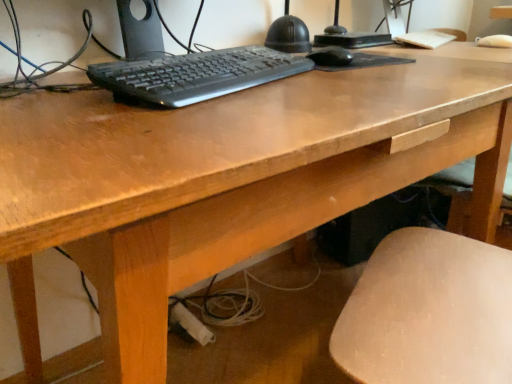
I want to click on black plastic keyboard at center, so click(196, 74).

Looking at this image, measure the distance between black plastic keyboard at center and camera.

black plastic keyboard at center and camera are 21.69 inches apart.

This screenshot has width=512, height=384. What do you see at coordinates (196, 74) in the screenshot?
I see `black plastic keyboard at center` at bounding box center [196, 74].

Identify the location of black matte mouse at center. This screenshot has height=384, width=512. (331, 57).

What do you see at coordinates (331, 57) in the screenshot? This screenshot has width=512, height=384. I see `black matte mouse at center` at bounding box center [331, 57].

The width and height of the screenshot is (512, 384). Identify the location of black plastic keyboard at center. (196, 74).

In the image, is black matte mouse at center on the left side or the right side of black plastic keyboard at center?

From the image, it's evident that black matte mouse at center is to the right of black plastic keyboard at center.

Relative to black plastic keyboard at center, is black matte mouse at center in front or behind?

In the image, black matte mouse at center appears behind black plastic keyboard at center.

Is point (320, 49) farther from viewer compared to point (204, 66)?

Yes, point (320, 49) is farther from viewer.

From the image's perspective, is black matte mouse at center positioned above or below black plastic keyboard at center?

Clearly, from the image's perspective, black matte mouse at center is above black plastic keyboard at center.

From a real-world perspective, who is located lower, black matte mouse at center or black plastic keyboard at center?

black matte mouse at center.

Considering the sizes of objects black matte mouse at center and black plastic keyboard at center in the image provided, who is thinner, black matte mouse at center or black plastic keyboard at center?

black matte mouse at center.

Considering the sizes of objects black matte mouse at center and black plastic keyboard at center in the image provided, who is taller, black matte mouse at center or black plastic keyboard at center?

black plastic keyboard at center is taller.

Who is smaller, black matte mouse at center or black plastic keyboard at center?

black matte mouse at center.

Does black matte mouse at center contain black plastic keyboard at center?

No.

Is black matte mouse at center directly adjacent to black plastic keyboard at center?

No, black matte mouse at center is not in contact with black plastic keyboard at center.

Is black matte mouse at center facing away from black plastic keyboard at center?

black matte mouse at center is not turned away from black plastic keyboard at center.

How different are the orientations of black matte mouse at center and black plastic keyboard at center in degrees?

1.61 degrees.

The image size is (512, 384). Find the location of `mouse that is on the right side of black plastic keyboard at center`. mouse that is on the right side of black plastic keyboard at center is located at coordinates (331, 57).

Is black plastic keyboard at center to the right of black matte mouse at center from the viewer's perspective?

No, black plastic keyboard at center is not to the right of black matte mouse at center.

Which object is further away from the camera, black plastic keyboard at center or black matte mouse at center?

black matte mouse at center is further from the camera.

Considering the points (113, 80) and (346, 61), which point is in front, point (113, 80) or point (346, 61)?

The point (113, 80) is more forward.

From the image's perspective, between black plastic keyboard at center and black matte mouse at center, which one is located above?

From the image's view, black matte mouse at center is above.

From a real-world perspective, who is located lower, black plastic keyboard at center or black matte mouse at center?

black matte mouse at center, from a real-world perspective.

Looking at their sizes, would you say black plastic keyboard at center is wider or thinner than black matte mouse at center?

In the image, black plastic keyboard at center appears to be wider than black matte mouse at center.

Does black plastic keyboard at center have a greater height compared to black matte mouse at center?

Indeed, black plastic keyboard at center has a greater height compared to black matte mouse at center.

Who is smaller, black plastic keyboard at center or black matte mouse at center?

With smaller size is black matte mouse at center.

Is black plastic keyboard at center located outside black matte mouse at center?

Absolutely, black plastic keyboard at center is external to black matte mouse at center.

Are black plastic keyboard at center and black matte mouse at center located far from each other?

No.

Could you tell me if black plastic keyboard at center is facing black matte mouse at center?

No, black plastic keyboard at center is not oriented towards black matte mouse at center.

How distant is black plastic keyboard at center from black matte mouse at center?

black plastic keyboard at center and black matte mouse at center are 9.62 inches apart.

Find the location of a particular element. Image resolution: width=512 pixels, height=384 pixels. mouse that appears below the black plastic keyboard at center (from a real-world perspective) is located at coordinates (331, 57).

At what (x,y) coordinates should I click in order to perform the action: click on computer keyboard located below the black matte mouse at center (from the image's perspective). Please return your answer as a coordinate pair (x, y). The height and width of the screenshot is (384, 512). Looking at the image, I should click on (x=196, y=74).

At what (x,y) coordinates should I click in order to perform the action: click on mouse behind the black plastic keyboard at center. Please return your answer as a coordinate pair (x, y). This screenshot has height=384, width=512. Looking at the image, I should click on (331, 57).